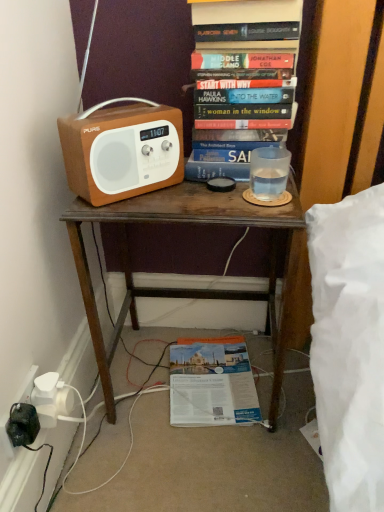
Question: Is the depth of hardcover book at upper center, which is the first book from front to back, less than that of matte brown radio at left?

Choices:
 (A) yes
 (B) no

Answer: (B)

Question: Is hardcover book at upper center, the 2th book in the bottom-to-top sequence, at the right side of matte brown radio at left?

Choices:
 (A) no
 (B) yes

Answer: (B)

Question: Is matte brown radio at left surrounded by hardcover book at upper center, the 2th book in the bottom-to-top sequence?

Choices:
 (A) no
 (B) yes

Answer: (A)

Question: Is matte brown radio at left at the back of hardcover book at upper center, placed as the second book when sorted from back to front?

Choices:
 (A) yes
 (B) no

Answer: (B)

Question: Does hardcover book at upper center, the 2th book in the bottom-to-top sequence, have a lesser height compared to matte brown radio at left?

Choices:
 (A) yes
 (B) no

Answer: (B)

Question: From the image's perspective, relative to matte brown radio at left, is hardcover book at upper center, which is the first book from front to back, above or below?

Choices:
 (A) above
 (B) below

Answer: (A)

Question: In terms of width, does hardcover book at upper center, which ranks as the 1th book in top-to-bottom order, look wider or thinner when compared to matte brown radio at left?

Choices:
 (A) wide
 (B) thin

Answer: (A)

Question: In the image, is hardcover book at upper center, the 2th book in the bottom-to-top sequence, positioned in front of or behind matte brown radio at left?

Choices:
 (A) behind
 (B) front

Answer: (A)

Question: Considering the positions of point (196, 39) and point (74, 135), is point (196, 39) closer or farther from the camera than point (74, 135)?

Choices:
 (A) farther
 (B) closer

Answer: (A)

Question: Is matte brown radio at left wider or thinner than brown wooden desk at center?

Choices:
 (A) wide
 (B) thin

Answer: (B)

Question: Considering their positions, is matte brown radio at left located in front of or behind brown wooden desk at center?

Choices:
 (A) front
 (B) behind

Answer: (A)

Question: Is matte brown radio at left to the left or to the right of brown wooden desk at center in the image?

Choices:
 (A) left
 (B) right

Answer: (A)

Question: From the image's perspective, is matte brown radio at left above or below brown wooden desk at center?

Choices:
 (A) below
 (B) above

Answer: (B)

Question: Looking at the image, does matte brown radio at left seem bigger or smaller compared to hardcover book at upper center, which is the first book from front to back?

Choices:
 (A) small
 (B) big

Answer: (A)

Question: Do you think matte brown radio at left is within hardcover book at upper center, which is the first book from front to back, or outside of it?

Choices:
 (A) inside
 (B) outside

Answer: (B)